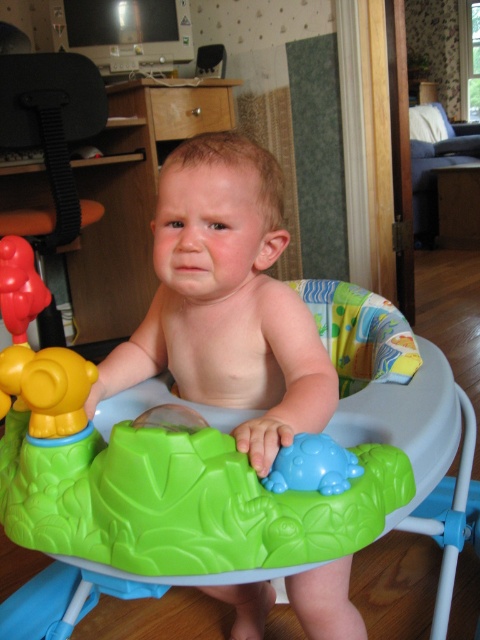
Who is more forward, (257, 314) or (475, 156)?

Point (257, 314) is in front.

Which of these two, smooth plastic walker at center or velvet blue couch at upper right, stands shorter?

smooth plastic walker at center is shorter.

Find the location of a particular element. The width and height of the screenshot is (480, 640). smooth plastic walker at center is located at coordinates (227, 301).

Can you confirm if black plastic feeding chair at left is bigger than blue rubber turtle at center?

Yes.

Who is higher up, black plastic feeding chair at left or blue rubber turtle at center?

black plastic feeding chair at left is above.

At what (x,y) coordinates should I click in order to perform the action: click on black plastic feeding chair at left. Please return your answer as a coordinate pair (x, y). This screenshot has width=480, height=640. Looking at the image, I should click on (50, 132).

Which is more to the right, smooth plastic walker at center or blue rubber turtle at center?

From the viewer's perspective, blue rubber turtle at center appears more on the right side.

Is smooth plastic walker at center shorter than blue rubber turtle at center?

Incorrect, smooth plastic walker at center's height does not fall short of blue rubber turtle at center's.

Is point (264, 296) farther from camera compared to point (340, 467)?

That is True.

This screenshot has width=480, height=640. I want to click on smooth plastic walker at center, so click(x=227, y=301).